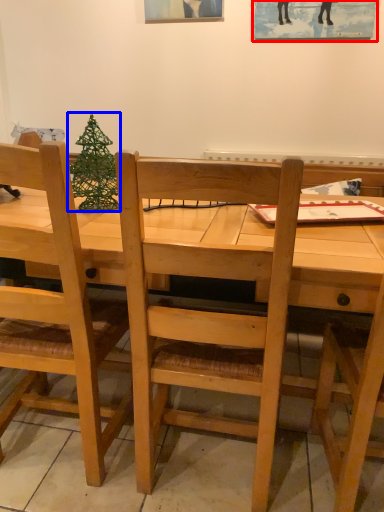
Question: Which point is closer to the camera, picture frame (highlighted by a red box) or christmas tree (highlighted by a blue box)?

Choices:
 (A) picture frame
 (B) christmas tree

Answer: (B)